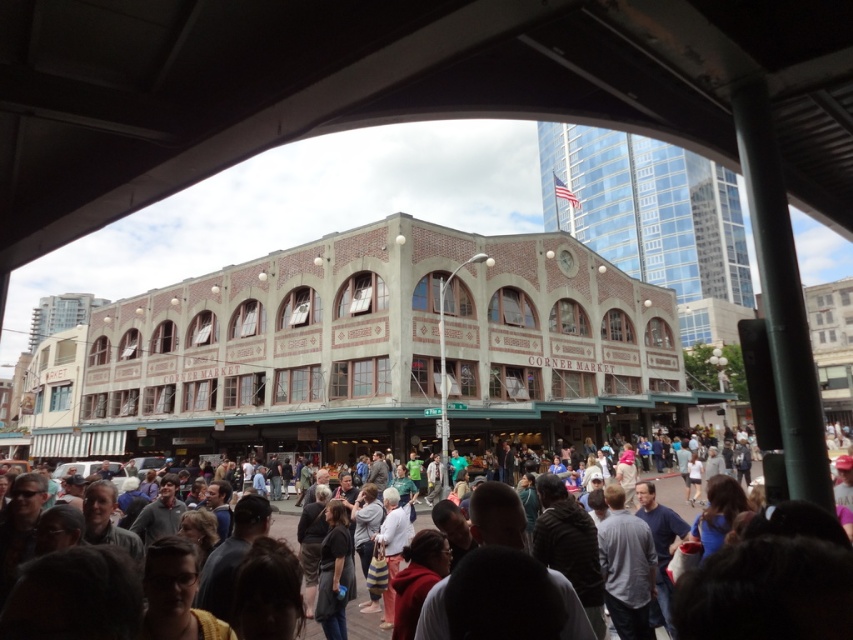
Question: Observing the image, what is the correct spatial positioning of brick building at center in reference to dark gray clothing at lower center?

Choices:
 (A) above
 (B) below

Answer: (A)

Question: Among these points, which one is nearest to the camera?

Choices:
 (A) (135, 312)
 (B) (357, 561)

Answer: (B)

Question: Does brick building at center appear on the left side of dark gray clothing at lower center?

Choices:
 (A) no
 (B) yes

Answer: (B)

Question: Can you confirm if brick building at center is thinner than dark gray clothing at lower center?

Choices:
 (A) yes
 (B) no

Answer: (B)

Question: Which of the following is the closest to the observer?

Choices:
 (A) (677, 477)
 (B) (645, 426)

Answer: (A)